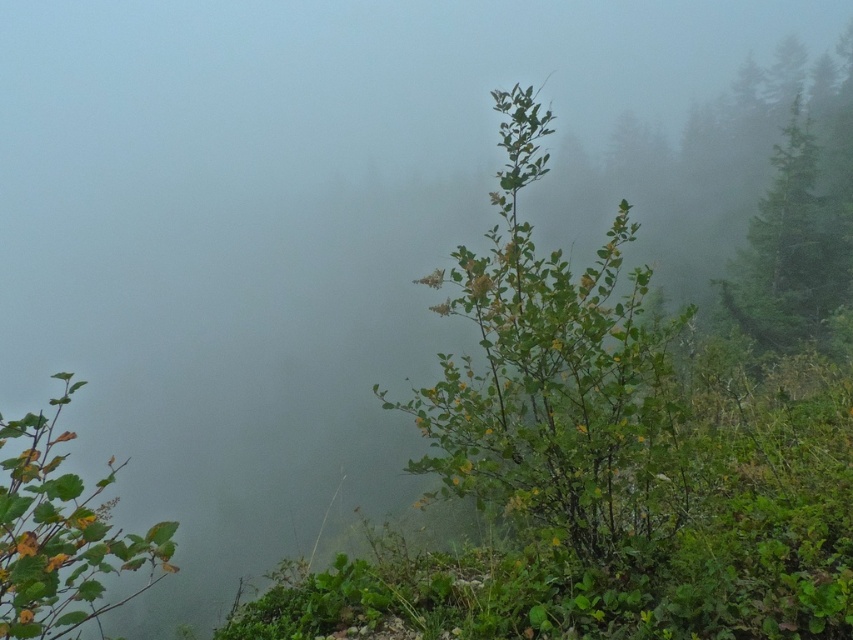
You are a photographer standing at the camera position. You want to take a closeup photo of the green leafy bush at center. Do you need to move closer or farther away from your current position to focus on the bush?

The green leafy bush at center is 3.35 meters away from the camera. To take a closeup photo, you need to move closer to the bush since you are currently 3.35 meters away, which may be too far for a closeup.

You are standing at the center of the image and want to locate the green leafy shrub at lower left. Which direction should you face to see it?

You should face the lower left direction to see the green leafy shrub at lower left.

You are a hiker trying to navigate through the misty landscape. You see the green leafy shrub at lower left and the green leafy tree at upper right. How far apart are these two landmarks?

The green leafy shrub at lower left is 30.08 meters from the green leafy tree at upper right.